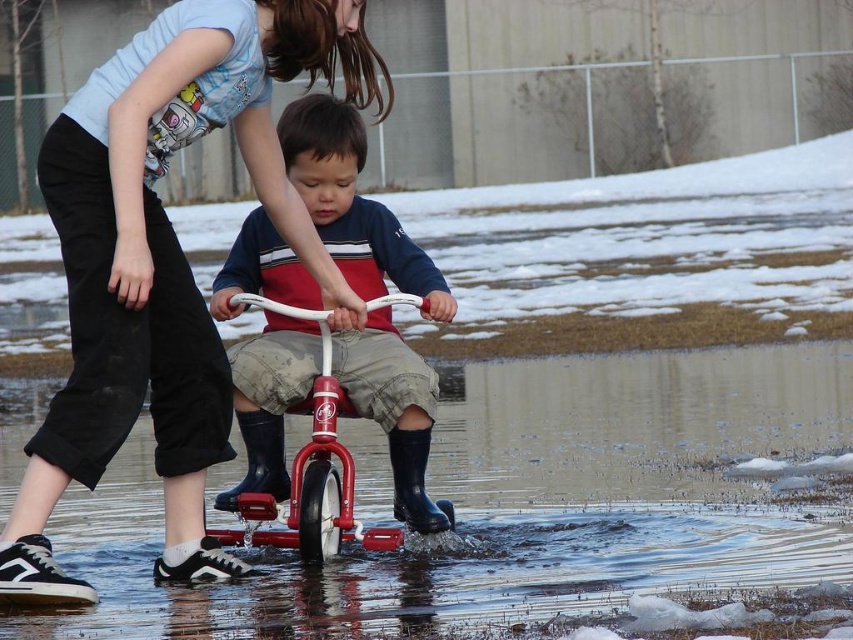
You are a parent trying to decide where to place a new toy box in the yard. The toy box must be placed between the matte black pants at lower left and the metallic red bicycle at center. Considering their sizes, which object should the toy box be closer to?

The toy box should be placed closer to the metallic red bicycle at center because the matte black pants at lower left occupies less space than the metallic red bicycle at center, so there is more space available near the bicycle.